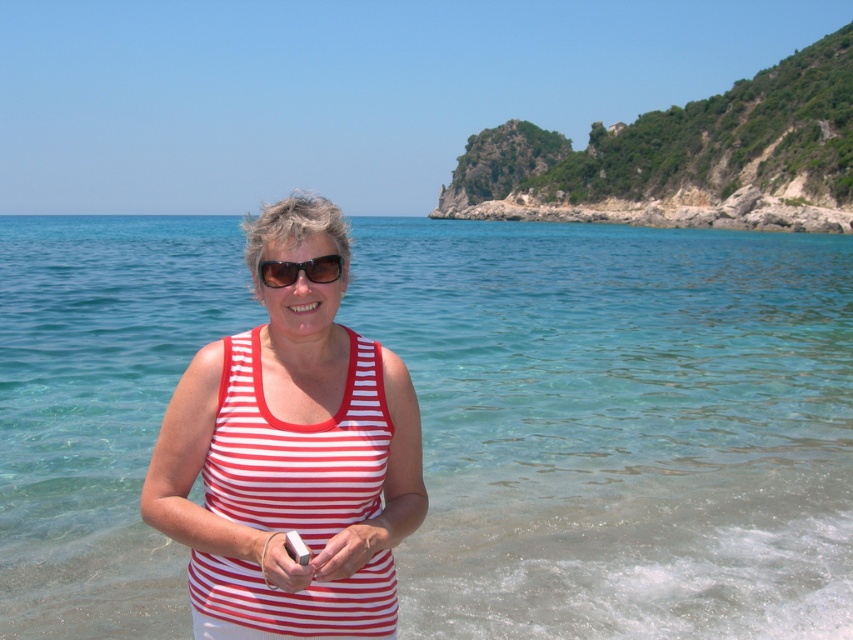
Question: In this image, where is clear water at center located relative to white striped tank top at center?

Choices:
 (A) above
 (B) below

Answer: (A)

Question: Which of these objects is positioned closest to the white striped tank top at center?

Choices:
 (A) black plastic sunglasses at center
 (B) clear water at center

Answer: (A)

Question: Which of these objects is positioned closest to the clear water at center?

Choices:
 (A) white striped tank top at center
 (B) black plastic sunglasses at center

Answer: (A)

Question: Based on their relative distances, which object is farther from the white striped tank top at center?

Choices:
 (A) black plastic sunglasses at center
 (B) clear water at center

Answer: (B)

Question: From the image, what is the correct spatial relationship of clear water at center in relation to white striped tank top at center?

Choices:
 (A) below
 (B) above

Answer: (B)

Question: Can you confirm if clear water at center is bigger than black plastic sunglasses at center?

Choices:
 (A) yes
 (B) no

Answer: (A)